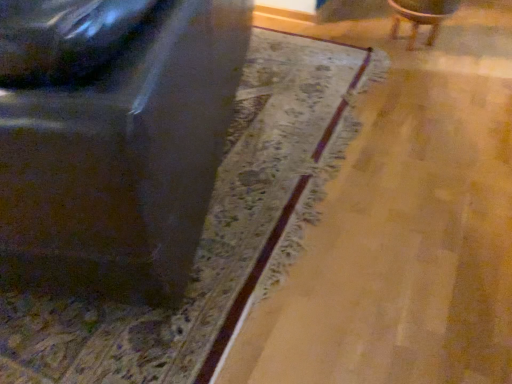
Question: From the image's perspective, is metallic silver chair at left, which is the second chair in right-to-left order, located above or below wooden chair at upper right, acting as the 2th chair starting from the left?

Choices:
 (A) below
 (B) above

Answer: (A)

Question: Based on their positions, is metallic silver chair at left, which is counted as the 1th chair, starting from the left, located to the left or right of wooden chair at upper right, acting as the 2th chair starting from the left?

Choices:
 (A) right
 (B) left

Answer: (B)

Question: Looking at their shapes, would you say metallic silver chair at left, which is counted as the 1th chair, starting from the left, is wider or thinner than wooden chair at upper right, the first chair in the right-to-left sequence?

Choices:
 (A) wide
 (B) thin

Answer: (A)

Question: Considering the positions of wooden chair at upper right, the first chair in the right-to-left sequence, and metallic silver chair at left, which is counted as the 1th chair, starting from the left, in the image, is wooden chair at upper right, the first chair in the right-to-left sequence, wider or thinner than metallic silver chair at left, which is counted as the 1th chair, starting from the left,?

Choices:
 (A) wide
 (B) thin

Answer: (B)

Question: Considering the positions of wooden chair at upper right, acting as the 2th chair starting from the left, and metallic silver chair at left, which is the second chair in right-to-left order, in the image, is wooden chair at upper right, acting as the 2th chair starting from the left, taller or shorter than metallic silver chair at left, which is the second chair in right-to-left order,?

Choices:
 (A) tall
 (B) short

Answer: (B)

Question: Is wooden chair at upper right, the first chair in the right-to-left sequence, bigger or smaller than metallic silver chair at left, which is counted as the 1th chair, starting from the left?

Choices:
 (A) big
 (B) small

Answer: (B)

Question: Considering their positions, is wooden chair at upper right, acting as the 2th chair starting from the left, located in front of or behind metallic silver chair at left, which is the second chair in right-to-left order?

Choices:
 (A) behind
 (B) front

Answer: (A)